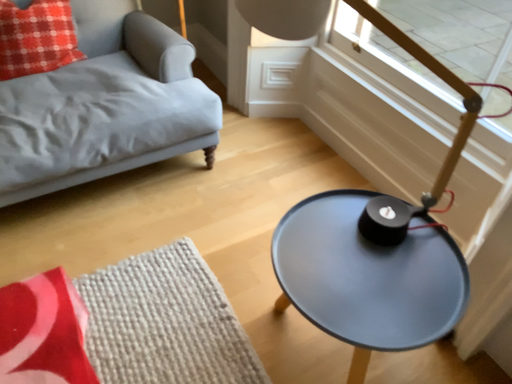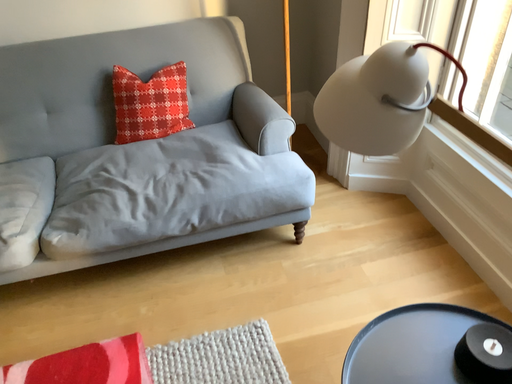
Question: Which way did the camera rotate in the video?

Choices:
 (A) rotated right
 (B) rotated left

Answer: (B)